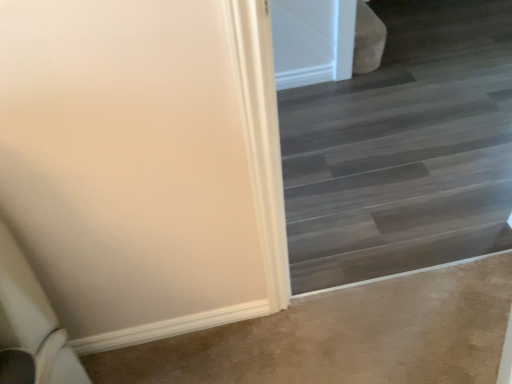
What is the approximate width of dark wood floor at center?

It is 9.41 inches.

Identify the location of dark wood floor at center. This screenshot has width=512, height=384. (403, 149).

What do you see at coordinates (403, 149) in the screenshot? The image size is (512, 384). I see `dark wood floor at center` at bounding box center [403, 149].

What do you see at coordinates (344, 336) in the screenshot? The width and height of the screenshot is (512, 384). I see `brown carpet at lower left` at bounding box center [344, 336].

You are a GUI agent. You are given a task and a screenshot of the screen. Output one action in this format:
    pyautogui.click(x=<x>, y=<y>)
    Task: Click on the brown carpet at lower left
    
    Given the screenshot: What is the action you would take?
    pyautogui.click(x=344, y=336)

Image resolution: width=512 pixels, height=384 pixels. I want to click on dark wood floor at center, so click(403, 149).

Which object is positioned more to the left, dark wood floor at center or brown carpet at lower left?

brown carpet at lower left is more to the left.

Between dark wood floor at center and brown carpet at lower left, which one is positioned in front?

Positioned in front is dark wood floor at center.

Which is in front, point (489, 152) or point (433, 300)?

The point (433, 300) is more forward.

From the image's perspective, which is below, dark wood floor at center or brown carpet at lower left?

From the image's view, brown carpet at lower left is below.

From a real-world perspective, between dark wood floor at center and brown carpet at lower left, who is vertically higher?

From a 3D spatial view, dark wood floor at center is above.

Does dark wood floor at center have a greater width compared to brown carpet at lower left?

Incorrect, the width of dark wood floor at center does not surpass that of brown carpet at lower left.

Can you confirm if dark wood floor at center is taller than brown carpet at lower left?

Indeed, dark wood floor at center has a greater height compared to brown carpet at lower left.

Does dark wood floor at center have a larger size compared to brown carpet at lower left?

Yes.

Is dark wood floor at center located outside brown carpet at lower left?

Yes.

Based on the photo, are dark wood floor at center and brown carpet at lower left making contact?

No, dark wood floor at center is not beside brown carpet at lower left.

Is dark wood floor at center oriented away from brown carpet at lower left?

dark wood floor at center is not turned away from brown carpet at lower left.

Find the location of a particular element. concrete below the dark wood floor at center (from a real-world perspective) is located at coordinates (344, 336).

Considering the positions of objects brown carpet at lower left and dark wood floor at center in the image provided, who is more to the left, brown carpet at lower left or dark wood floor at center?

Positioned to the left is brown carpet at lower left.

Which object is more forward, brown carpet at lower left or dark wood floor at center?

Positioned in front is dark wood floor at center.

Which is nearer, (487, 313) or (370, 184)?

Point (487, 313)

From the image's perspective, is brown carpet at lower left positioned above or below dark wood floor at center?

From the image's perspective, brown carpet at lower left appears below dark wood floor at center.

From a real-world perspective, is brown carpet at lower left physically below dark wood floor at center?

Correct, in the physical world, brown carpet at lower left is lower than dark wood floor at center.

Can you confirm if brown carpet at lower left is thinner than dark wood floor at center?

No, brown carpet at lower left is not thinner than dark wood floor at center.

Can you confirm if brown carpet at lower left is shorter than dark wood floor at center?

Indeed, brown carpet at lower left has a lesser height compared to dark wood floor at center.

Who is bigger, brown carpet at lower left or dark wood floor at center?

dark wood floor at center is bigger.

Is brown carpet at lower left not within dark wood floor at center?

Yes, brown carpet at lower left is not within dark wood floor at center.

From the picture: Would you consider brown carpet at lower left to be distant from dark wood floor at center?

brown carpet at lower left is actually quite close to dark wood floor at center.

Is brown carpet at lower left turned away from dark wood floor at center?

brown carpet at lower left does not have its back to dark wood floor at center.

How distant is brown carpet at lower left from dark wood floor at center?

61.50 centimeters.

Locate an element on the screen. This screenshot has width=512, height=384. stairwell above the brown carpet at lower left (from a real-world perspective) is located at coordinates (403, 149).

Locate an element on the screen. The height and width of the screenshot is (384, 512). stairwell that is above the brown carpet at lower left (from the image's perspective) is located at coordinates tap(403, 149).

The width and height of the screenshot is (512, 384). In order to click on stairwell above the brown carpet at lower left (from a real-world perspective) in this screenshot , I will do `click(403, 149)`.